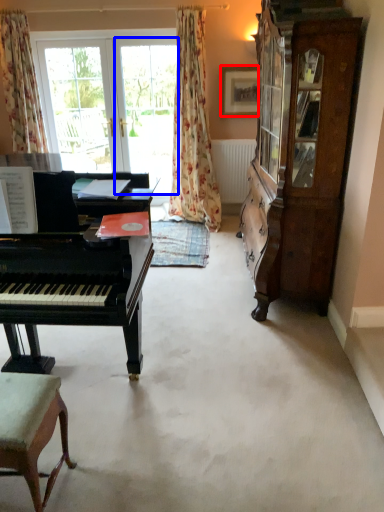
Question: Which point is closer to the camera, picture frame (highlighted by a red box) or screen door (highlighted by a blue box)?

Choices:
 (A) picture frame
 (B) screen door

Answer: (A)